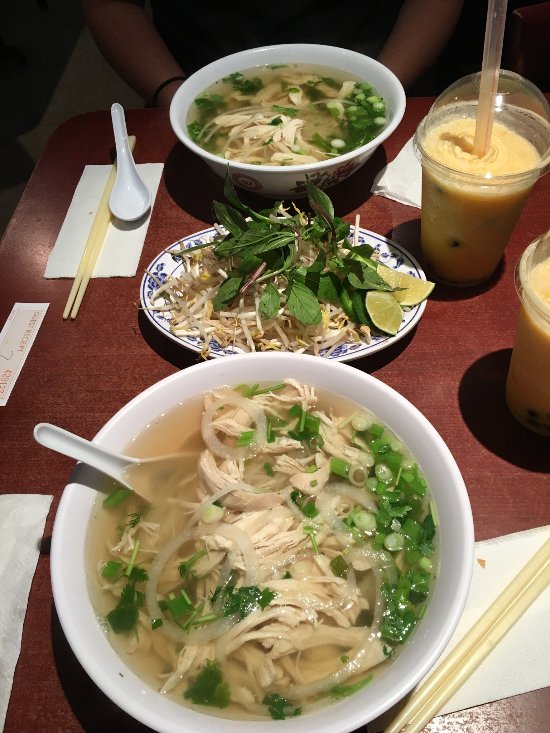
The height and width of the screenshot is (733, 550). I want to click on spoon, so click(x=72, y=443), click(x=125, y=150).